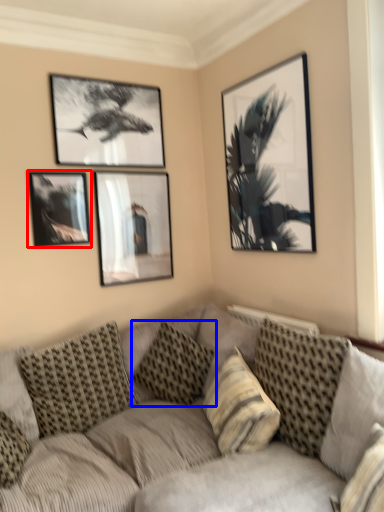
Question: Which point is further to the camera, picture frame (highlighted by a red box) or pillow (highlighted by a blue box)?

Choices:
 (A) picture frame
 (B) pillow

Answer: (A)